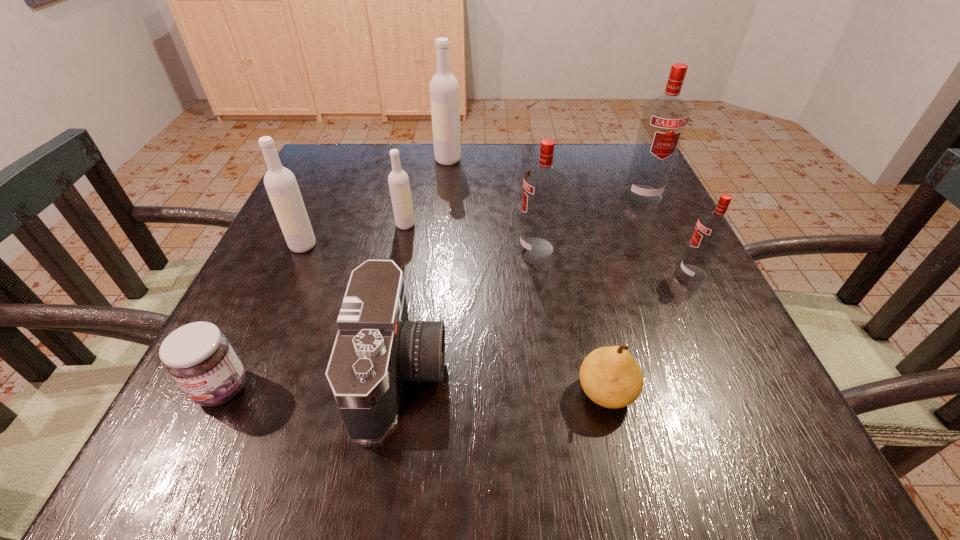
Locate an element on the screen. The height and width of the screenshot is (540, 960). vodka that is positioned at the left edge is located at coordinates (280, 183).

This screenshot has width=960, height=540. In order to click on jam positioned at the left edge in this screenshot , I will do `click(199, 357)`.

The height and width of the screenshot is (540, 960). Find the location of `object situated at the far right corner`. object situated at the far right corner is located at coordinates (664, 119).

Identify the location of free space at the far edge. (470, 150).

The image size is (960, 540). What are the coordinates of `vacant space at the near edge` in the screenshot? It's located at (578, 416).

Where is `vacant position at the left edge of the desktop`? vacant position at the left edge of the desktop is located at coordinates (305, 254).

Locate an element on the screen. The height and width of the screenshot is (540, 960). vacant space at the right edge of the desktop is located at coordinates click(x=672, y=233).

This screenshot has width=960, height=540. What are the coordinates of `vacant space at the far left corner of the desktop` in the screenshot? It's located at pos(335,147).

In the image, there is a desktop. Identify the location of vacant space at the near left corner. (253, 434).

Where is `free space that is in between the leftmost vodka and the jam`? The image size is (960, 540). free space that is in between the leftmost vodka and the jam is located at coordinates (262, 317).